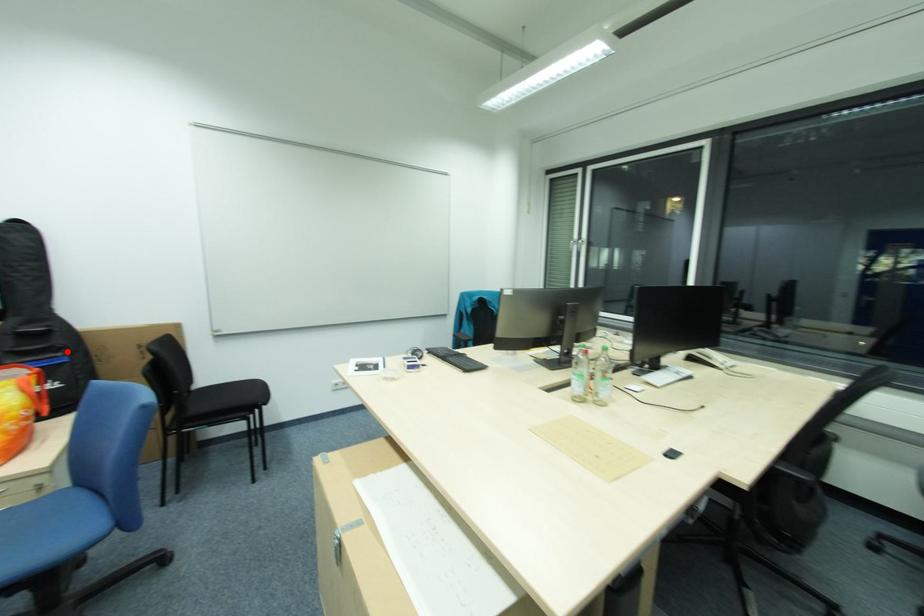
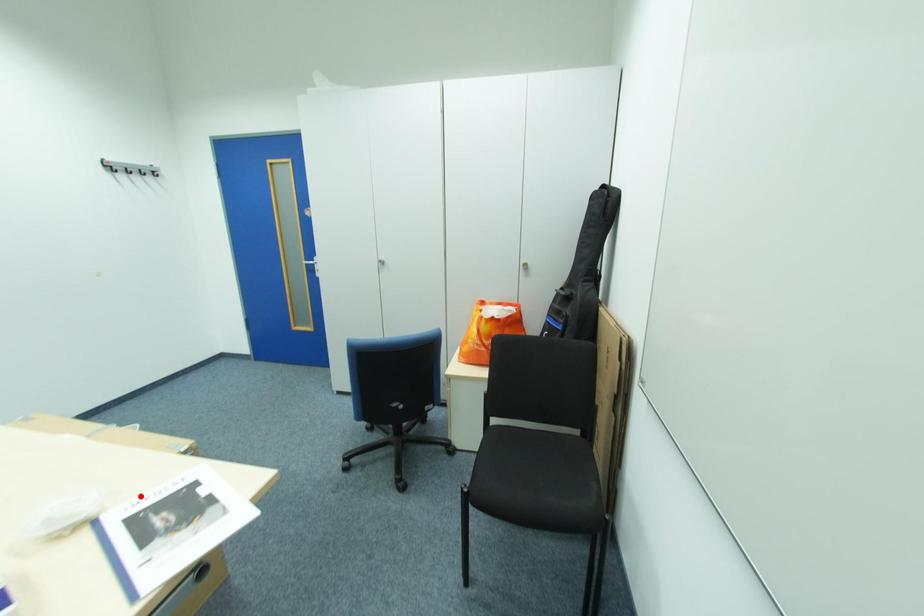
I am providing you with two images of the same scene from different viewpoints. A red point is marked on the first image and another point is marked on the second image. Is the marked point in image1 the same physical position as the marked point in image2?

No